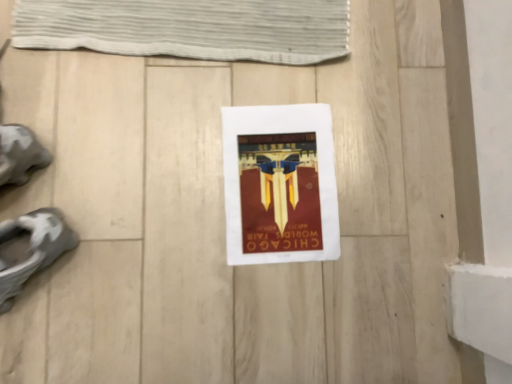
Where is `empty space that is ontop of matte paper poster at center (from a real-world perspective)`? empty space that is ontop of matte paper poster at center (from a real-world perspective) is located at coordinates (284, 186).